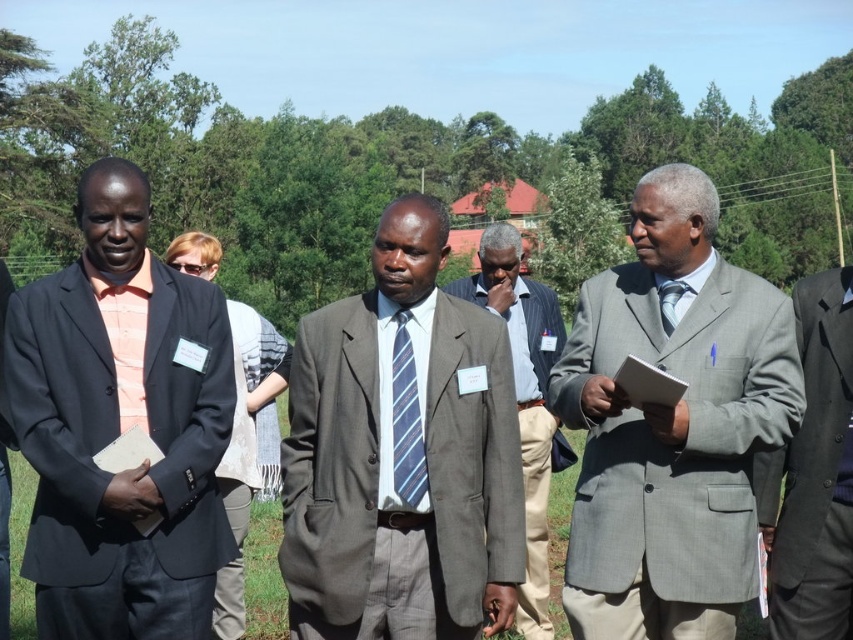
Consider the image. Does gray wool suit at center appear on the right side of blue striped tie at center?

Yes, gray wool suit at center is to the right of blue striped tie at center.

The height and width of the screenshot is (640, 853). Describe the element at coordinates (672, 426) in the screenshot. I see `gray wool suit at center` at that location.

Does point (695, 298) lie in front of point (408, 353)?

No, it is behind (408, 353).

I want to click on gray wool suit at center, so click(x=672, y=426).

Between gray wool suit at center and gray wool suit at right, which one has less height?

Standing shorter between the two is gray wool suit at right.

Can you confirm if gray wool suit at center is smaller than gray wool suit at right?

No, gray wool suit at center is not smaller than gray wool suit at right.

Is point (634, 524) positioned after point (840, 301)?

No, it is not.

Where is `gray wool suit at center`? gray wool suit at center is located at coordinates (672, 426).

Can you confirm if gray wool suit at right is thinner than blue striped tie at center?

No.

Between point (843, 304) and point (421, 484), which one is positioned behind?

The point (843, 304) is more distant.

Who is more forward, (769, 550) or (402, 404)?

Point (402, 404) is more forward.

At what (x,y) coordinates should I click in order to perform the action: click on gray wool suit at right. Please return your answer as a coordinate pair (x, y). Looking at the image, I should click on (815, 474).